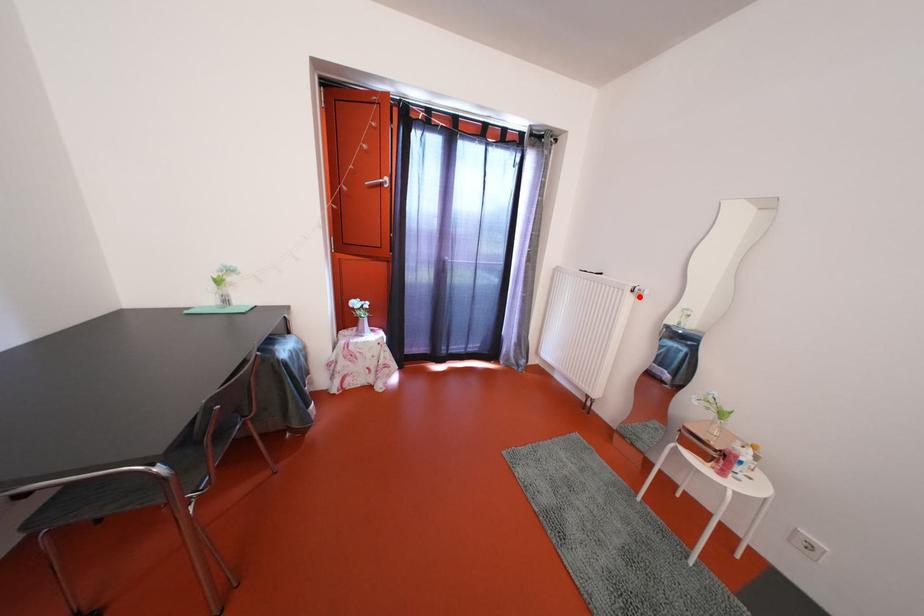
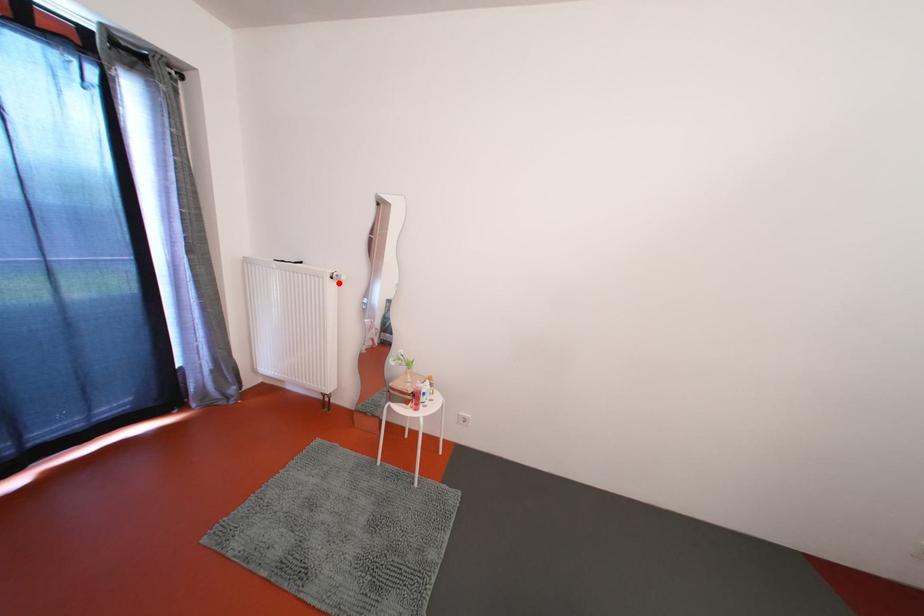
I am providing you with two images of the same scene from different viewpoints. A red point is marked on the first image and another point is marked on the second image. Are the points marked in image1 and image2 representing the same 3D position?

Yes